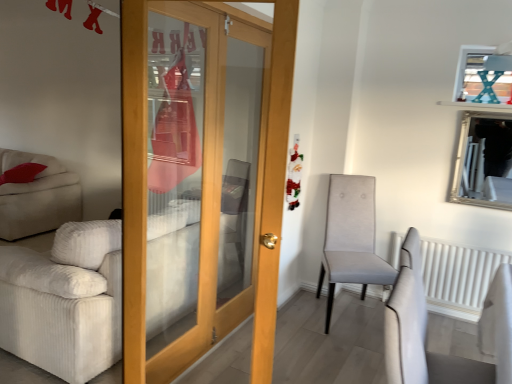
Question: Is white textured radiator at right placed right next to silver/glass mirror at upper right?

Choices:
 (A) no
 (B) yes

Answer: (A)

Question: Is white textured radiator at right shorter than silver/glass mirror at upper right?

Choices:
 (A) no
 (B) yes

Answer: (B)

Question: Is silver/glass mirror at upper right at the back of white textured radiator at right?

Choices:
 (A) no
 (B) yes

Answer: (A)

Question: Is white textured radiator at right positioned before silver/glass mirror at upper right?

Choices:
 (A) no
 (B) yes

Answer: (A)

Question: From a real-world perspective, is white textured radiator at right positioned over silver/glass mirror at upper right based on gravity?

Choices:
 (A) yes
 (B) no

Answer: (B)

Question: Is white textured radiator at right at the left side of silver/glass mirror at upper right?

Choices:
 (A) yes
 (B) no

Answer: (A)

Question: Can you confirm if silver/glass mirror at upper right is positioned to the left of light gray fabric chair at center-right?

Choices:
 (A) no
 (B) yes

Answer: (A)

Question: Does silver/glass mirror at upper right lie behind light gray fabric chair at center-right?

Choices:
 (A) no
 (B) yes

Answer: (B)

Question: Can you confirm if silver/glass mirror at upper right is wider than light gray fabric chair at center-right?

Choices:
 (A) no
 (B) yes

Answer: (A)

Question: From a real-world perspective, is silver/glass mirror at upper right positioned over light gray fabric chair at center-right based on gravity?

Choices:
 (A) yes
 (B) no

Answer: (A)

Question: Can you confirm if silver/glass mirror at upper right is smaller than light gray fabric chair at center-right?

Choices:
 (A) yes
 (B) no

Answer: (A)

Question: Can you confirm if silver/glass mirror at upper right is taller than light gray fabric chair at center-right?

Choices:
 (A) yes
 (B) no

Answer: (B)

Question: From a real-world perspective, is wooden door at center beneath silver/glass mirror at upper right?

Choices:
 (A) yes
 (B) no

Answer: (A)